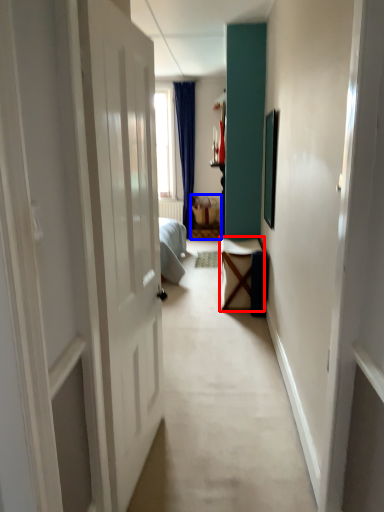
Question: Which object appears farthest to the camera in this image, furniture (highlighted by a red box) or furniture (highlighted by a blue box)?

Choices:
 (A) furniture
 (B) furniture

Answer: (B)